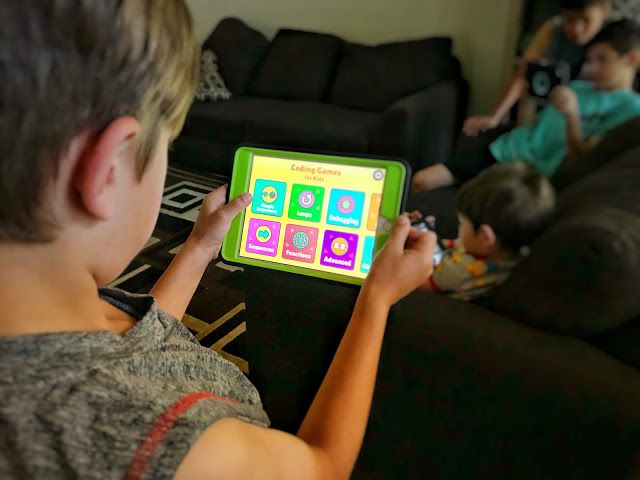
The width and height of the screenshot is (640, 480). I want to click on walls, so tap(408, 15).